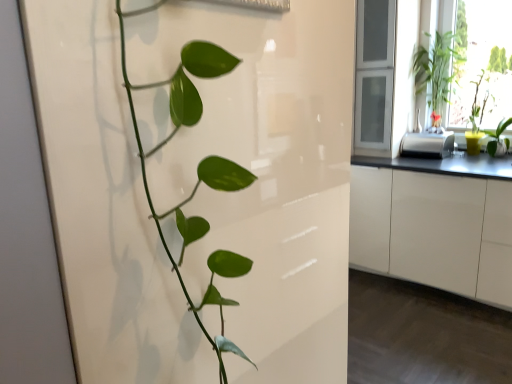
Question: Is clear glass window frame at upper right bigger than green glossy plant at right, the 1th houseplant from the right?

Choices:
 (A) yes
 (B) no

Answer: (A)

Question: Does clear glass window frame at upper right lie behind green glossy plant at right, which is the 2th houseplant from front to back?

Choices:
 (A) no
 (B) yes

Answer: (B)

Question: Is clear glass window frame at upper right not near green glossy plant at right, marked as the 4th houseplant in a left-to-right arrangement?

Choices:
 (A) no
 (B) yes

Answer: (A)

Question: Is clear glass window frame at upper right facing towards green glossy plant at right, which is the 2th houseplant from front to back?

Choices:
 (A) no
 (B) yes

Answer: (A)

Question: From the image's perspective, does clear glass window frame at upper right appear lower than green glossy plant at right, which is the 2th houseplant from front to back?

Choices:
 (A) no
 (B) yes

Answer: (A)

Question: From the image's perspective, is white glossy cabinetry at right located above or below green glossy plant at left, acting as the 4th houseplant starting from the back?

Choices:
 (A) below
 (B) above

Answer: (A)

Question: Relative to green glossy plant at left, the 1th houseplant positioned from the left, is white glossy cabinetry at right in front or behind?

Choices:
 (A) behind
 (B) front

Answer: (A)

Question: Is white glossy cabinetry at right bigger or smaller than green glossy plant at left, the 1th houseplant positioned from the left?

Choices:
 (A) small
 (B) big

Answer: (B)

Question: Choose the correct answer: Is white glossy cabinetry at right inside green glossy plant at left, the 1th houseplant positioned from the left, or outside it?

Choices:
 (A) inside
 (B) outside

Answer: (B)

Question: From a real-world perspective, relative to clear glass window frame at upper right, is green leafy plant at upper right vertically above or below?

Choices:
 (A) below
 (B) above

Answer: (A)

Question: Is point (494, 66) closer or farther from the camera than point (355, 122)?

Choices:
 (A) farther
 (B) closer

Answer: (B)

Question: In the image, is green leafy plant at upper right positioned in front of or behind clear glass window frame at upper right?

Choices:
 (A) behind
 (B) front

Answer: (B)

Question: Considering the relative positions of green leafy plant at upper right and clear glass window frame at upper right in the image provided, is green leafy plant at upper right to the left or to the right of clear glass window frame at upper right?

Choices:
 (A) left
 (B) right

Answer: (B)

Question: Is white glossy cabinetry at right inside the boundaries of clear glass window frame at upper right, or outside?

Choices:
 (A) outside
 (B) inside

Answer: (A)

Question: Considering the positions of white glossy cabinetry at right and clear glass window frame at upper right in the image, is white glossy cabinetry at right wider or thinner than clear glass window frame at upper right?

Choices:
 (A) thin
 (B) wide

Answer: (B)